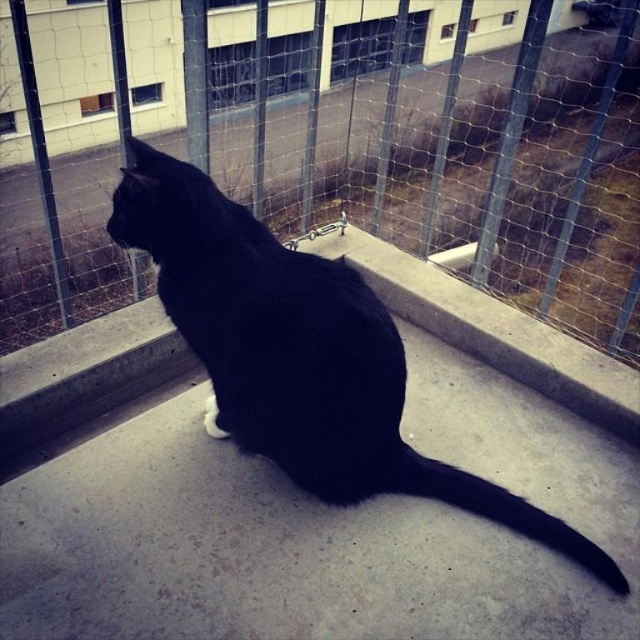
You are a photographer trying to capture a clear image of the black matte fur cat at center. However, there is a metal mesh fence at upper center in the way. Can you adjust your position to take a photo of the cat without the fence blocking the view?

The metal mesh fence at upper center is positioned over the black matte fur cat at center, so adjusting your position might allow you to angle the camera below or around the fence to capture the cat without obstruction.

You are a delivery drone trying to deliver a package to the black matte fur cat at center. The drone has a width of 0.5 meters. Can you safely fly through the metal mesh fence at upper center to reach the cat?

The metal mesh fence at upper center might be wider than the black matte fur cat at center, but since the drone is 0.5 meters wide, it is uncertain if the fence opening is wide enough. The cat might be positioned in a spot where the fence allows passage, but without exact measurements, it is risky to assume the drone can safely pass through.

Consider the image. You are standing on the concrete surface where the black cat is sitting. You want to see the building with large windows and doors in the background. Which direction should you look relative to the metal mesh fence at upper center?

The building with large windows and doors is behind the metal mesh fence at upper center, so you should look through the metal mesh fence at upper center to see it.